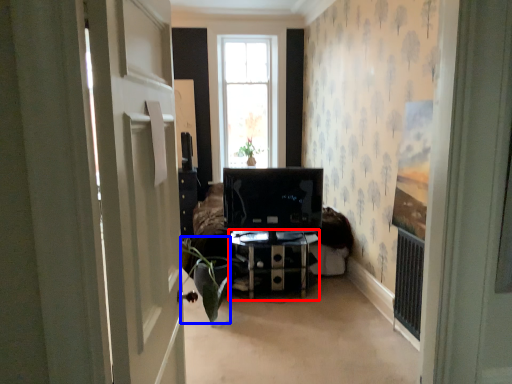
Question: Which object appears farthest to the camera in this image, furniture (highlighted by a red box) or plant (highlighted by a blue box)?

Choices:
 (A) furniture
 (B) plant

Answer: (A)